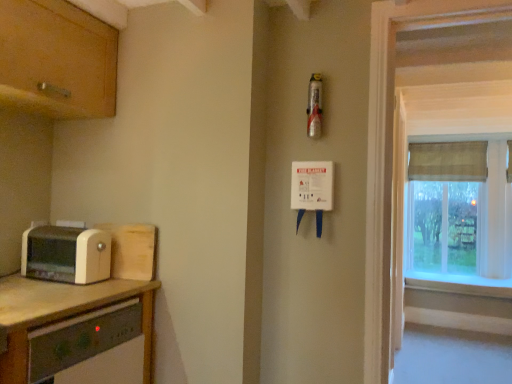
Question: From the image's perspective, is white painted wood at right on top of beige plastic toaster at left?

Choices:
 (A) yes
 (B) no

Answer: (B)

Question: Is white painted wood at right far from beige plastic toaster at left?

Choices:
 (A) no
 (B) yes

Answer: (B)

Question: Is white painted wood at right in front of beige plastic toaster at left?

Choices:
 (A) yes
 (B) no

Answer: (B)

Question: Is white painted wood at right outside of beige plastic toaster at left?

Choices:
 (A) yes
 (B) no

Answer: (A)

Question: From a real-world perspective, is white painted wood at right located beneath beige plastic toaster at left?

Choices:
 (A) yes
 (B) no

Answer: (A)

Question: In terms of height, does textured beige curtain at right look taller or shorter compared to wooden cabinet at upper left, which ranks as the 2th cabinetry in bottom-to-top order?

Choices:
 (A) short
 (B) tall

Answer: (B)

Question: From the image's perspective, relative to wooden cabinet at upper left, which is the first cabinetry in top-to-bottom order, is textured beige curtain at right above or below?

Choices:
 (A) above
 (B) below

Answer: (B)

Question: Considering the positions of textured beige curtain at right and wooden cabinet at upper left, which ranks as the 2th cabinetry in bottom-to-top order, in the image, is textured beige curtain at right bigger or smaller than wooden cabinet at upper left, which ranks as the 2th cabinetry in bottom-to-top order,?

Choices:
 (A) small
 (B) big

Answer: (B)

Question: Is point (479, 200) positioned closer to the camera than point (24, 84)?

Choices:
 (A) farther
 (B) closer

Answer: (A)

Question: Would you say white laminate countertop at lower left is to the left or to the right of wooden toaster at left, the first cabinetry ordered from the bottom, in the picture?

Choices:
 (A) right
 (B) left

Answer: (B)

Question: Considering their positions, is white laminate countertop at lower left located in front of or behind wooden toaster at left, which is counted as the second cabinetry, starting from the top?

Choices:
 (A) behind
 (B) front

Answer: (B)

Question: Is point (147, 372) positioned closer to the camera than point (129, 264)?

Choices:
 (A) closer
 (B) farther

Answer: (A)

Question: From their relative heights in the image, would you say white laminate countertop at lower left is taller or shorter than wooden toaster at left, which is counted as the second cabinetry, starting from the top?

Choices:
 (A) short
 (B) tall

Answer: (B)

Question: Is point (401, 97) closer or farther from the camera than point (496, 291)?

Choices:
 (A) farther
 (B) closer

Answer: (B)

Question: Is clear plastic screen door at right inside the boundaries of white painted wood at right, or outside?

Choices:
 (A) outside
 (B) inside

Answer: (A)